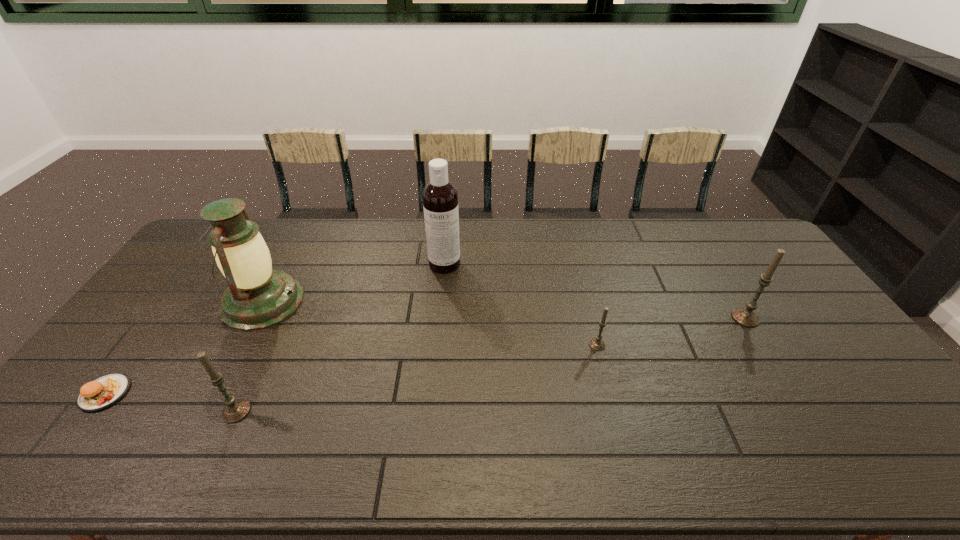
This screenshot has width=960, height=540. I want to click on free point between the leftmost object and the third object from right to left, so click(x=275, y=328).

At what (x,y) coordinates should I click in order to perform the action: click on vacant space that's between the leftmost object and the shortest candle. Please return your answer as a coordinate pair (x, y). The height and width of the screenshot is (540, 960). Looking at the image, I should click on (351, 369).

The width and height of the screenshot is (960, 540). Find the location of `blank region between the shortest candle and the third object from right to left`. blank region between the shortest candle and the third object from right to left is located at coordinates (521, 305).

The height and width of the screenshot is (540, 960). Find the location of `vacant area that lies between the lantern and the second shortest candle`. vacant area that lies between the lantern and the second shortest candle is located at coordinates (250, 356).

Identify the location of free space that is in between the dishwasher detergent and the shortest candle. (521, 305).

I want to click on vacant region between the second shortest object and the farthest candle, so click(671, 332).

This screenshot has height=540, width=960. In order to click on empty space between the rightmost object and the shortest object in this screenshot , I will do `click(425, 355)`.

Where is `the closest object to the farthest object`? The image size is (960, 540). the closest object to the farthest object is located at coordinates (258, 297).

Choose which object is the nearest neighbor to the third shortest object. Please provide its 2D coordinates. Your answer should be formatted as a tuple, i.e. [(x, y)], where the tuple contains the x and y coordinates of a point satisfying the conditions above.

[(258, 297)]

Locate which candle ranks third in proximity to the farthest object. Please provide its 2D coordinates. Your answer should be formatted as a tuple, i.e. [(x, y)], where the tuple contains the x and y coordinates of a point satisfying the conditions above.

[(747, 317)]